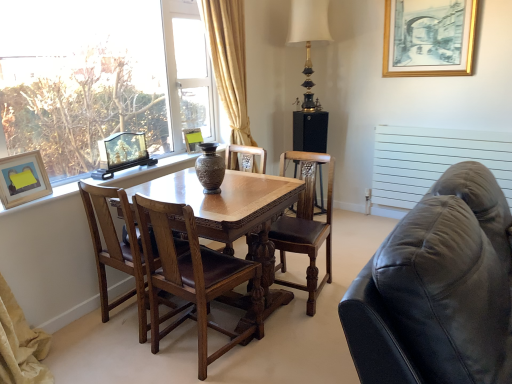
At what (x,y) coordinates should I click in order to perform the action: click on vacant region in front of mahogany wood chair at center, the third chair from the left. Please return your answer as a coordinate pair (x, y). This screenshot has height=384, width=512. Looking at the image, I should click on (302, 331).